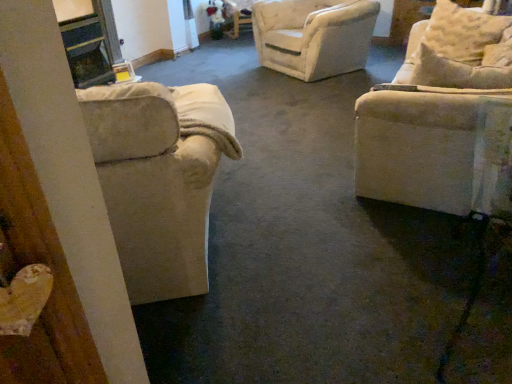
Question: Does beige fabric armchair at left, marked as the second chair in a right-to-left arrangement, turn towards beige fabric pillow at upper right?

Choices:
 (A) no
 (B) yes

Answer: (A)

Question: From a real-world perspective, is beige fabric armchair at left, marked as the second chair in a right-to-left arrangement, positioned over beige fabric pillow at upper right based on gravity?

Choices:
 (A) no
 (B) yes

Answer: (A)

Question: Can you confirm if beige fabric armchair at left, marked as the second chair in a right-to-left arrangement, is taller than beige fabric pillow at upper right?

Choices:
 (A) yes
 (B) no

Answer: (A)

Question: Considering the relative sizes of beige fabric armchair at left, which is the first chair in left-to-right order, and beige fabric pillow at upper right in the image provided, is beige fabric armchair at left, which is the first chair in left-to-right order, thinner than beige fabric pillow at upper right?

Choices:
 (A) yes
 (B) no

Answer: (B)

Question: Does beige fabric armchair at left, which is the first chair in left-to-right order, appear on the right side of beige fabric pillow at upper right?

Choices:
 (A) yes
 (B) no

Answer: (B)

Question: Based on their positions, is beige fabric couch at right, positioned as the second chair in left-to-right order, located to the left or right of beige fabric armchair at left, which is the first chair in left-to-right order?

Choices:
 (A) left
 (B) right

Answer: (B)

Question: From the image's perspective, relative to beige fabric armchair at left, marked as the second chair in a right-to-left arrangement, is beige fabric couch at right, positioned as the second chair in left-to-right order, above or below?

Choices:
 (A) below
 (B) above

Answer: (B)

Question: Relative to beige fabric armchair at left, marked as the second chair in a right-to-left arrangement, is beige fabric couch at right, positioned as the second chair in left-to-right order, in front or behind?

Choices:
 (A) behind
 (B) front

Answer: (A)

Question: Is point (435, 187) positioned closer to the camera than point (193, 215)?

Choices:
 (A) closer
 (B) farther

Answer: (B)

Question: From the image's perspective, is beige fabric pillow at upper right located above or below beige fabric couch at right, positioned as the second chair in left-to-right order?

Choices:
 (A) below
 (B) above

Answer: (B)

Question: Is beige fabric pillow at upper right wider or thinner than beige fabric couch at right, positioned as the second chair in left-to-right order?

Choices:
 (A) thin
 (B) wide

Answer: (B)

Question: Is point [x=455, y=29] positioned closer to the camera than point [x=479, y=206]?

Choices:
 (A) farther
 (B) closer

Answer: (A)

Question: Is beige fabric pillow at upper right taller or shorter than beige fabric couch at right, positioned as the second chair in left-to-right order?

Choices:
 (A) tall
 (B) short

Answer: (A)

Question: Is beige fabric pillow at upper right wider or thinner than beige fabric armchair at left, which is the first chair in left-to-right order?

Choices:
 (A) wide
 (B) thin

Answer: (B)

Question: Is beige fabric pillow at upper right inside or outside of beige fabric armchair at left, which is the first chair in left-to-right order?

Choices:
 (A) outside
 (B) inside

Answer: (A)